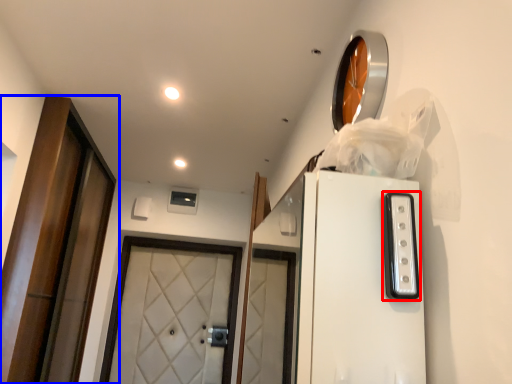
Question: Which point is closer to the camera, appliance (highlighted by a red box) or door (highlighted by a blue box)?

Choices:
 (A) appliance
 (B) door

Answer: (A)